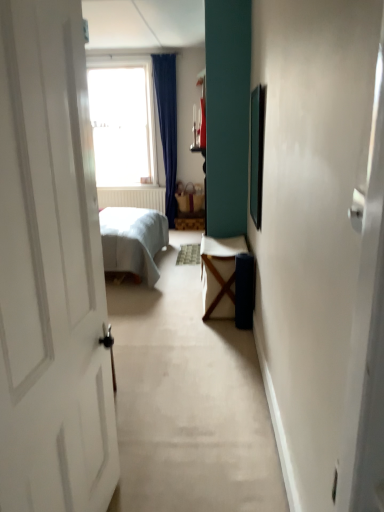
Question: Considering the positions of transparent glass window at upper center and wooden table at center in the image, is transparent glass window at upper center bigger or smaller than wooden table at center?

Choices:
 (A) small
 (B) big

Answer: (B)

Question: From the image's perspective, relative to wooden table at center, is transparent glass window at upper center above or below?

Choices:
 (A) below
 (B) above

Answer: (B)

Question: Considering the real-world distances, which object is farthest from the matte brown wicker basket at center?

Choices:
 (A) transparent glass window at upper center
 (B) wooden table at center

Answer: (B)

Question: Estimate the real-world distances between objects in this image. Which object is farther from the transparent glass window at upper center?

Choices:
 (A) matte brown wicker basket at center
 (B) wooden table at center

Answer: (B)